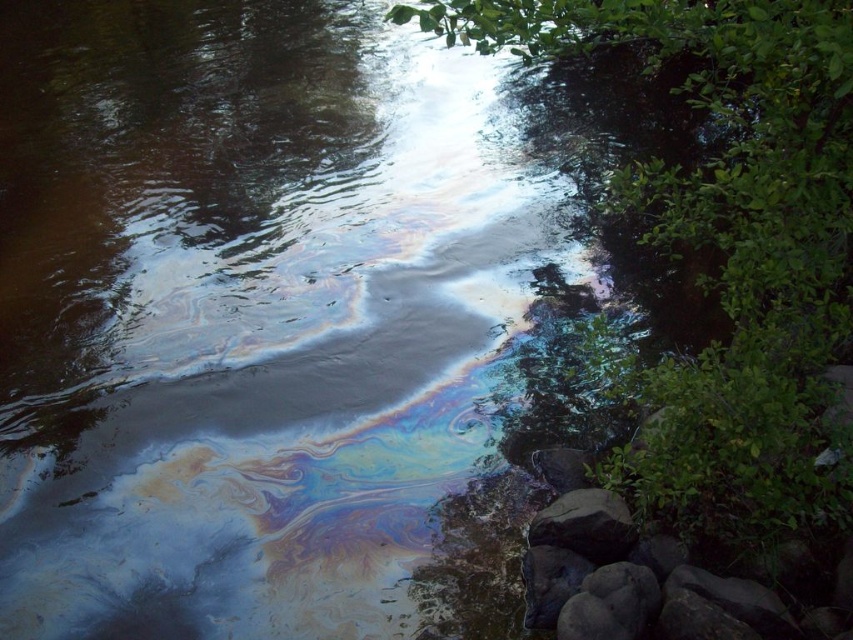
You are standing at the edge of the river and want to reach the point marked at coordinates point (670, 243). If your walking speed is 1.5 meters per second, how long will it take you to reach that point?

The point (670, 243) is 5.99 meters from the viewer. At a walking speed of 1.5 meters per second, it will take approximately 4 seconds to reach the point.

You are a researcher studying the river and need to place a 70 cm measuring tape between the green leafy tree at upper right and the smooth gray rock at lower right. Will the measuring tape reach both ends without bending?

The distance between the green leafy tree at upper right and the smooth gray rock at lower right is 68.84 centimeters, so the 70 cm measuring tape will be long enough to reach both ends without bending.

You are standing at the center of the image and want to locate the green leafy tree at upper right. According to the image coordinates, what are the exact coordinates where you should look to find it?

The green leafy tree at upper right is located at the 2D coordinates of point (727, 248).